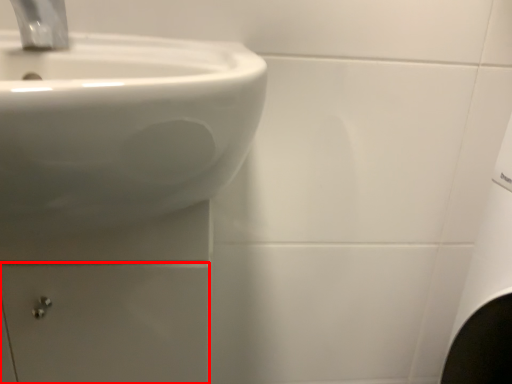
Question: From the image, what is the correct spatial relationship of drawer (annotated by the red box) in relation to tap?

Choices:
 (A) left
 (B) right

Answer: (A)